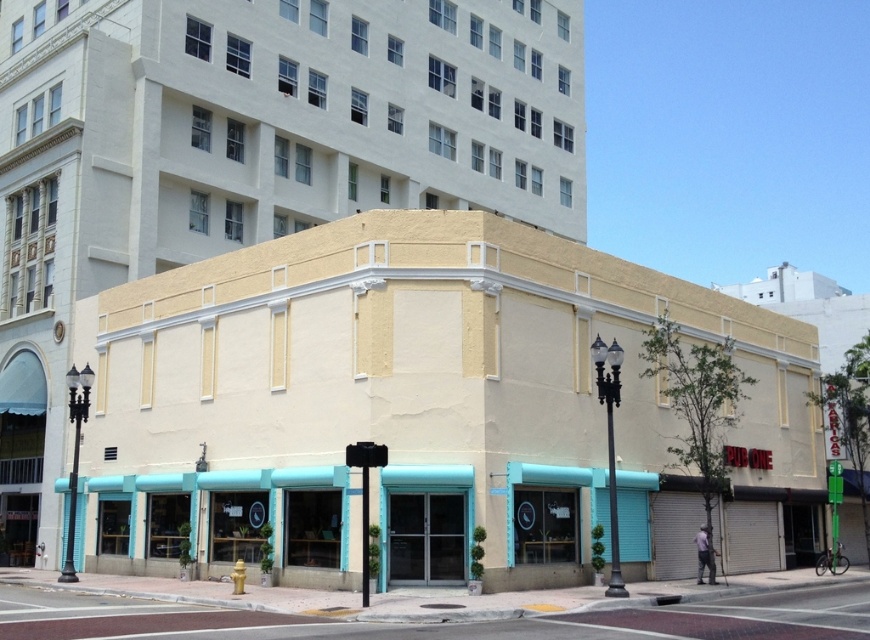
Measure the distance between matte yellow building at center and smooth concrete sidewalk at lower center.

Result: matte yellow building at center and smooth concrete sidewalk at lower center are 6.33 meters apart from each other.

Is point (478, 396) less distant than point (115, 600)?

No, it is behind (115, 600).

Identify the location of matte yellow building at center. The image size is (870, 640). (420, 406).